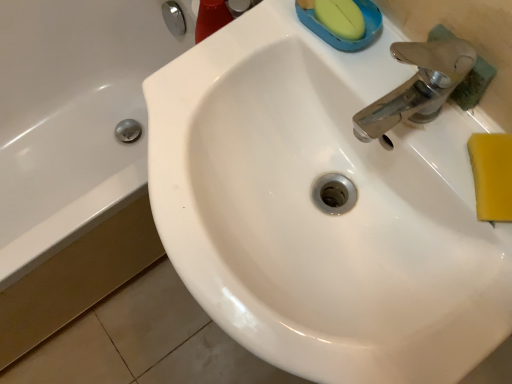
The height and width of the screenshot is (384, 512). What do you see at coordinates (72, 118) in the screenshot?
I see `white glossy bathtub at left` at bounding box center [72, 118].

What are the coordinates of `white glossy sink at center` in the screenshot? It's located at (319, 210).

Considering the sizes of objects white glossy bathtub at left and white glossy sink at center in the image provided, who is taller, white glossy bathtub at left or white glossy sink at center?

With more height is white glossy sink at center.

In the scene shown: Is white glossy bathtub at left completely or partially outside of white glossy sink at center?

Yes.

Identify the location of bath behind the white glossy sink at center. This screenshot has height=384, width=512. (72, 118).

From a real-world perspective, is white glossy bathtub at left positioned under white glossy sink at center based on gravity?

Yes, from a real-world perspective, white glossy bathtub at left is under white glossy sink at center.

Can you confirm if white glossy bathtub at left is positioned to the left of yellow sponge at right?

Correct, you'll find white glossy bathtub at left to the left of yellow sponge at right.

Is white glossy bathtub at left positioned beyond the bounds of yellow sponge at right?

Yes.

Is white glossy bathtub at left oriented towards yellow sponge at right?

No.

Where is `soap located below the white glossy bathtub at left (from the image's perspective)`? This screenshot has width=512, height=384. soap located below the white glossy bathtub at left (from the image's perspective) is located at coordinates 492,175.

From a real-world perspective, relative to white glossy bathtub at left, is white glossy sink at center vertically above or below?

In terms of real-world spatial position, white glossy sink at center is above white glossy bathtub at left.

Between white glossy sink at center and white glossy bathtub at left, which one has more height?

With more height is white glossy sink at center.

Can you see white glossy sink at center touching white glossy bathtub at left?

white glossy sink at center is not next to white glossy bathtub at left, and they're not touching.

Is white glossy sink at center to the right of white glossy bathtub at left from the viewer's perspective?

Yes, white glossy sink at center is to the right of white glossy bathtub at left.

How much distance is there between yellow sponge at right and white glossy sink at center?

yellow sponge at right and white glossy sink at center are 8.09 inches apart.

Is yellow sponge at right facing towards white glossy sink at center?

No, yellow sponge at right does not turn towards white glossy sink at center.

At what (x,y) coordinates should I click in order to perform the action: click on sink on the left side of yellow sponge at right. Please return your answer as a coordinate pair (x, y). Looking at the image, I should click on (319, 210).

Between yellow sponge at right and white glossy sink at center, which one is positioned behind?

white glossy sink at center is behind.

What are the coordinates of `bath directly beneath the yellow sponge at right (from a real-world perspective)` in the screenshot? It's located at (72, 118).

Would you consider yellow sponge at right to be distant from white glossy bathtub at left?

Absolutely, yellow sponge at right is distant from white glossy bathtub at left.

Which of these two, yellow sponge at right or white glossy bathtub at left, stands shorter?

Standing shorter between the two is yellow sponge at right.

Is white glossy bathtub at left a part of yellow sponge at right?

No, white glossy bathtub at left is not inside yellow sponge at right.

Based on the photo, does white glossy sink at center have a lesser width compared to yellow sponge at right?

No, white glossy sink at center is not thinner than yellow sponge at right.

In the scene shown: Which object is further away from the camera, white glossy sink at center or yellow sponge at right?

white glossy sink at center is behind.

Is white glossy sink at center to the right of yellow sponge at right from the viewer's perspective?

In fact, white glossy sink at center is to the left of yellow sponge at right.

Is yellow sponge at right at the back of white glossy sink at center?

That's not correct — white glossy sink at center is not looking away from yellow sponge at right.

You are a GUI agent. You are given a task and a screenshot of the screen. Output one action in this format:
    pyautogui.click(x=<x>, y=<y>)
    Task: Click on the bath below the white glossy sink at center (from a real-world perspective)
    The image size is (512, 384).
    Given the screenshot: What is the action you would take?
    pyautogui.click(x=72, y=118)

Find the location of a particular element. The image size is (512, 384). soap in front of the white glossy bathtub at left is located at coordinates (492, 175).

Estimate the real-world distances between objects in this image. Which object is further from yellow sponge at right, white glossy bathtub at left or white glossy sink at center?

Among the two, white glossy bathtub at left is located further to yellow sponge at right.

Considering their positions, is white glossy bathtub at left positioned closer to white glossy sink at center than yellow sponge at right?

The object closer to white glossy sink at center is yellow sponge at right.

Looking at the image, which one is located further to white glossy bathtub at left, yellow sponge at right or white glossy sink at center?

Among the two, yellow sponge at right is located further to white glossy bathtub at left.

Which object lies nearer to the anchor point white glossy sink at center, yellow sponge at right or white glossy bathtub at left?

Among the two, yellow sponge at right is located nearer to white glossy sink at center.

Considering their positions, is white glossy sink at center positioned closer to yellow sponge at right than white glossy bathtub at left?

The object closer to yellow sponge at right is white glossy sink at center.

Considering their positions, is white glossy sink at center positioned closer to white glossy bathtub at left than yellow sponge at right?

white glossy sink at center is closer to white glossy bathtub at left.

This screenshot has height=384, width=512. I want to click on sink situated between white glossy bathtub at left and yellow sponge at right from left to right, so click(319, 210).